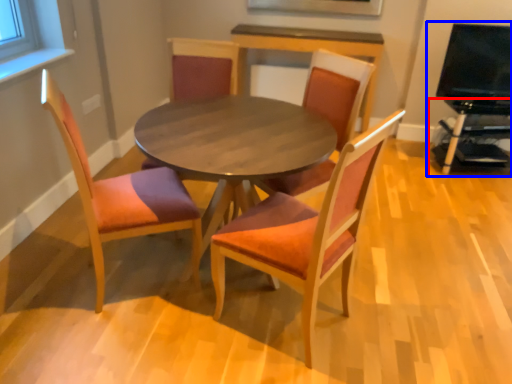
Question: Which object is further to the camera taking this photo, entertainment center (highlighted by a red box) or entertainment center (highlighted by a blue box)?

Choices:
 (A) entertainment center
 (B) entertainment center

Answer: (A)